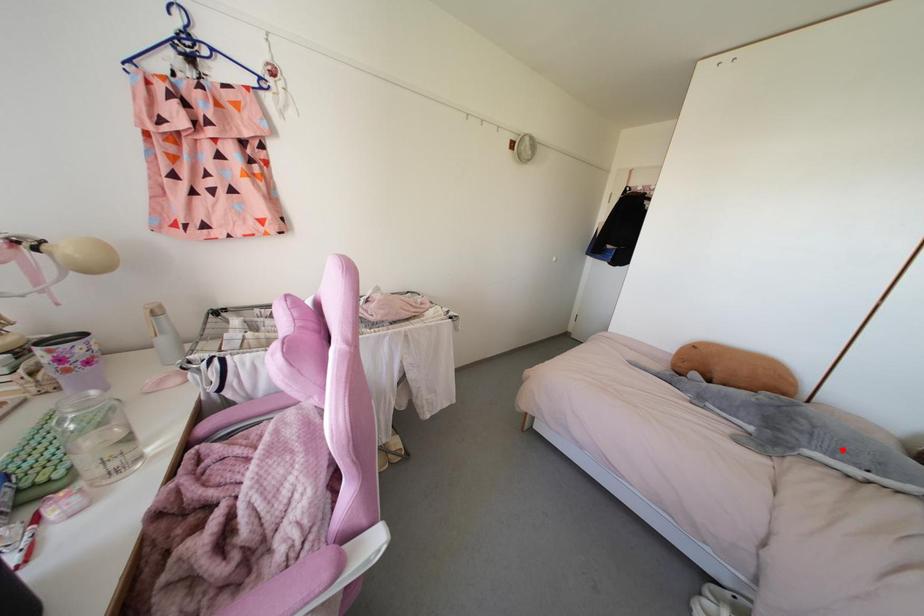
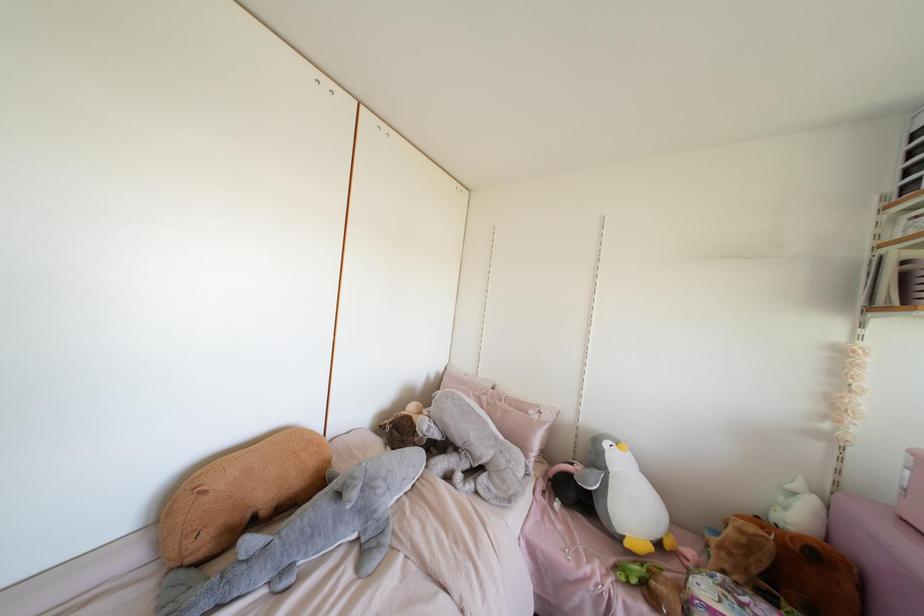
Find the pixel in the second image that matches the highlighted location in the first image.

(403, 479)